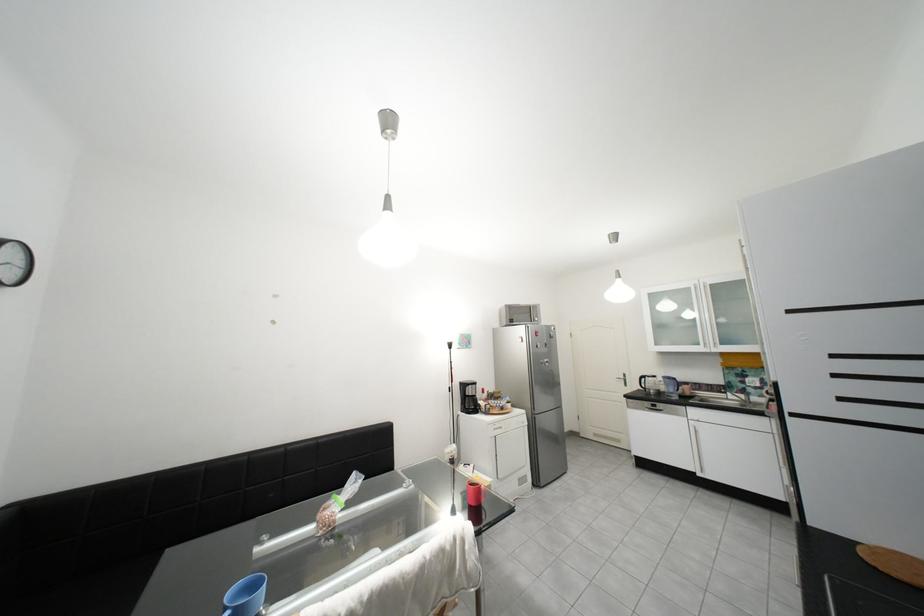
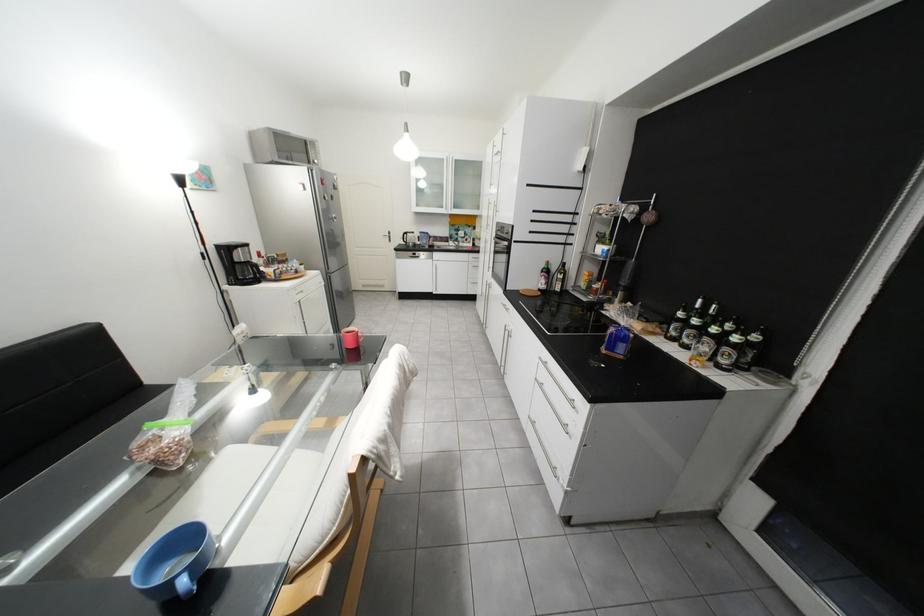
Find the pixel in the second image that matches point (637, 376) in the first image.

(402, 233)